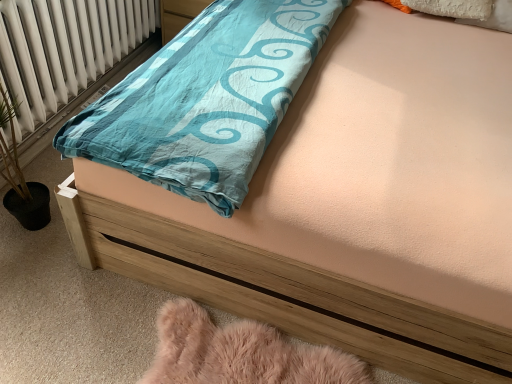
This screenshot has width=512, height=384. I want to click on white radiator at left, so point(66,53).

What do you see at coordinates (66, 53) in the screenshot?
I see `white radiator at left` at bounding box center [66, 53].

The image size is (512, 384). Identify the location of fuzzy pink rug at lower left. (240, 353).

This screenshot has height=384, width=512. Describe the element at coordinates (240, 353) in the screenshot. I see `fuzzy pink rug at lower left` at that location.

This screenshot has height=384, width=512. Find the location of `white radiator at left`. white radiator at left is located at coordinates (66, 53).

Considering the relative positions of white radiator at left and fuzzy pink rug at lower left in the image provided, is white radiator at left to the left of fuzzy pink rug at lower left from the viewer's perspective?

Yes.

Which object is further away from the camera taking this photo, white radiator at left or fuzzy pink rug at lower left?

white radiator at left is behind.

Considering the points (104, 33) and (195, 372), which point is in front, point (104, 33) or point (195, 372)?

Point (195, 372)

From the image's perspective, which one is positioned lower, white radiator at left or fuzzy pink rug at lower left?

fuzzy pink rug at lower left appears lower in the image.

From a real-world perspective, is white radiator at left positioned over fuzzy pink rug at lower left based on gravity?

Yes, from a real-world perspective, white radiator at left is above fuzzy pink rug at lower left.

Can you confirm if white radiator at left is thinner than fuzzy pink rug at lower left?

No.

Is white radiator at left shorter than fuzzy pink rug at lower left?

No.

Considering the relative sizes of white radiator at left and fuzzy pink rug at lower left in the image provided, is white radiator at left bigger than fuzzy pink rug at lower left?

Correct, white radiator at left is larger in size than fuzzy pink rug at lower left.

Is fuzzy pink rug at lower left surrounded by white radiator at left?

No, fuzzy pink rug at lower left is not surrounded by white radiator at left.

Are white radiator at left and fuzzy pink rug at lower left making contact?

No.

Is fuzzy pink rug at lower left at the back of white radiator at left?

No, white radiator at left is not facing away from fuzzy pink rug at lower left.

Looking at this image, can you tell me how much white radiator at left and fuzzy pink rug at lower left differ in facing direction?

The angle between the facing direction of white radiator at left and the facing direction of fuzzy pink rug at lower left is 1.02 degrees.

How far apart are white radiator at left and fuzzy pink rug at lower left?

They are 1.31 meters apart.

Locate an element on the screen. This screenshot has width=512, height=384. radiator that is behind the fuzzy pink rug at lower left is located at coordinates (66, 53).

Considering the positions of objects fuzzy pink rug at lower left and white radiator at left in the image provided, who is more to the right, fuzzy pink rug at lower left or white radiator at left?

fuzzy pink rug at lower left is more to the right.

Is the depth of fuzzy pink rug at lower left greater than that of white radiator at left?

No, the depth of fuzzy pink rug at lower left is less than that of white radiator at left.

Is point (164, 307) positioned in front of point (34, 102)?

Yes, it is in front of point (34, 102).

From the image's perspective, would you say fuzzy pink rug at lower left is shown under white radiator at left?

Yes.

From a real-world perspective, which object stands above the other?

white radiator at left, from a real-world perspective.

In the scene shown: Looking at their sizes, would you say fuzzy pink rug at lower left is wider or thinner than white radiator at left?

In the image, fuzzy pink rug at lower left appears to be more narrow than white radiator at left.

Based on the photo, which of these two, fuzzy pink rug at lower left or white radiator at left, stands shorter?

With less height is fuzzy pink rug at lower left.

Considering the relative sizes of fuzzy pink rug at lower left and white radiator at left in the image provided, is fuzzy pink rug at lower left bigger than white radiator at left?

No, fuzzy pink rug at lower left is not bigger than white radiator at left.

Is fuzzy pink rug at lower left situated inside white radiator at left or outside?

fuzzy pink rug at lower left is spatially situated outside white radiator at left.

Is fuzzy pink rug at lower left far from white radiator at left?

Indeed, fuzzy pink rug at lower left is not near white radiator at left.

Is white radiator at left at the back of fuzzy pink rug at lower left?

No, fuzzy pink rug at lower left is not facing away from white radiator at left.

Find the location of a particular element. The image size is (512, 384). radiator behind the fuzzy pink rug at lower left is located at coordinates (66, 53).

Where is `material below the white radiator at left (from a real-world perspective)`? This screenshot has width=512, height=384. material below the white radiator at left (from a real-world perspective) is located at coordinates (240, 353).

Image resolution: width=512 pixels, height=384 pixels. In order to click on radiator above the fuzzy pink rug at lower left (from a real-world perspective) in this screenshot , I will do `click(66, 53)`.